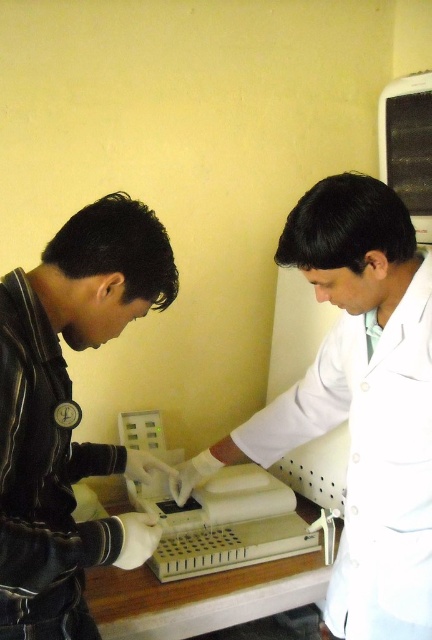
Between white lab coat at center and white matte gloves at left, which one appears on the left side from the viewer's perspective?

white matte gloves at left

Is white lab coat at center closer to the viewer compared to white matte gloves at left?

No, white lab coat at center is further to the viewer.

Is point (409, 244) behind point (63, 516)?

Yes, point (409, 244) is behind point (63, 516).

Find the location of a particular element. Image resolution: width=432 pixels, height=640 pixels. white lab coat at center is located at coordinates (359, 403).

Can you confirm if white matte gloves at left is bigger than white plastic test tubes at center?

Yes, white matte gloves at left is bigger than white plastic test tubes at center.

Does white matte gloves at left come behind white plastic test tubes at center?

No, white matte gloves at left is closer to the viewer.

The width and height of the screenshot is (432, 640). Find the location of `white matte gloves at left`. white matte gloves at left is located at coordinates (69, 412).

Between white lab coat at center and white plastic test tubes at center, which one appears on the left side from the viewer's perspective?

Positioned to the left is white plastic test tubes at center.

Looking at this image, does white lab coat at center lie behind white plastic test tubes at center?

That is False.

Is point (428, 564) positioned in front of point (237, 472)?

Yes, it is in front of point (237, 472).

You are a GUI agent. You are given a task and a screenshot of the screen. Output one action in this format:
    pyautogui.click(x=<x>, y=<y>)
    Task: Click on the white lab coat at center
    
    Given the screenshot: What is the action you would take?
    pyautogui.click(x=359, y=403)